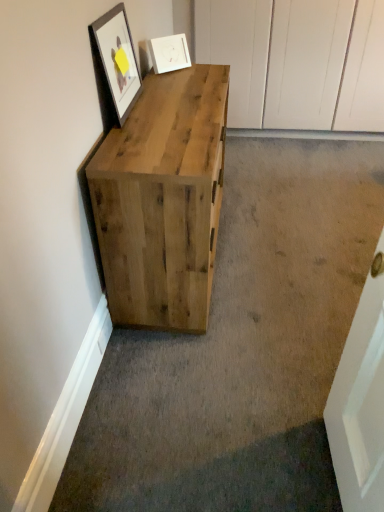
I want to click on vacant area that lies in front of white matte picture frame at upper center, which ranks as the 1th picture frame in right-to-left order, so click(185, 77).